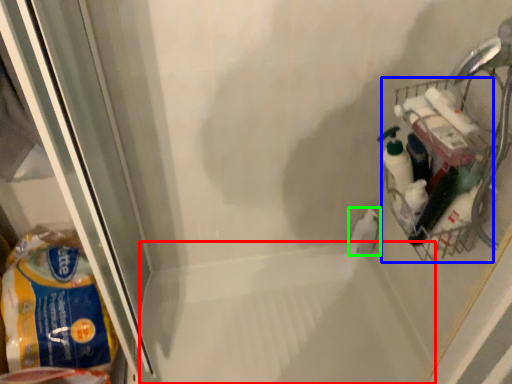
Question: Based on their relative distances, which object is farther from bath (highlighted by a red box)? Choose from basket (highlighted by a blue box) and cleaning product (highlighted by a green box).

Choices:
 (A) basket
 (B) cleaning product

Answer: (A)